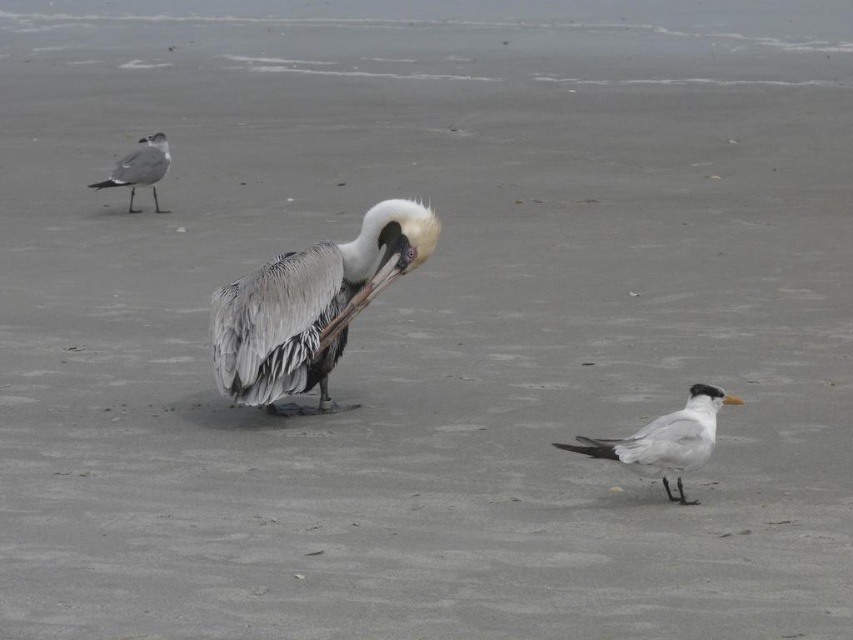
Question: Is gray feathered pelican at center closer to the viewer compared to yellow beak bird at lower right?

Choices:
 (A) no
 (B) yes

Answer: (A)

Question: Which point is farther from the camera taking this photo?

Choices:
 (A) (331, 276)
 (B) (727, 403)
 (C) (161, 141)

Answer: (C)

Question: Is gray feathered pelican at center bigger than yellow beak bird at lower right?

Choices:
 (A) yes
 (B) no

Answer: (A)

Question: Which point is closer to the camera?

Choices:
 (A) yellow beak bird at lower right
 (B) gray matte seagull at upper left

Answer: (A)

Question: Does yellow beak bird at lower right have a smaller size compared to gray matte seagull at upper left?

Choices:
 (A) no
 (B) yes

Answer: (B)

Question: Which of these objects is positioned farthest from the gray feathered pelican at center?

Choices:
 (A) gray matte seagull at upper left
 (B) yellow beak bird at lower right

Answer: (A)